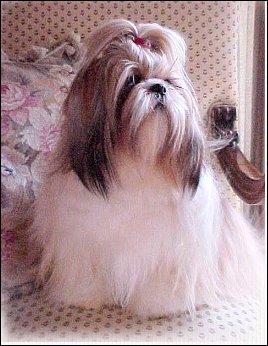
At what (x,y) coordinates should I click in order to perform the action: click on the chest. Please return your answer as a coordinate pair (x, y). The image size is (268, 346). Looking at the image, I should click on [143, 165].